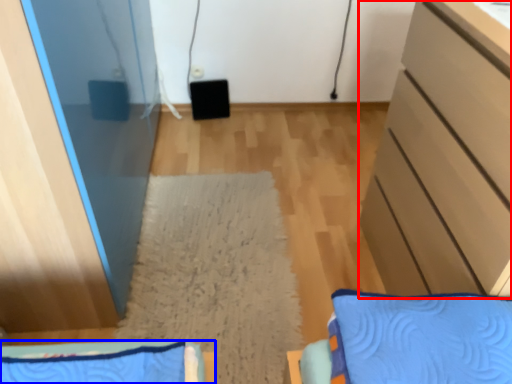
Question: Which object is closer to the camera taking this photo, cabinetry (highlighted by a red box) or furniture (highlighted by a blue box)?

Choices:
 (A) cabinetry
 (B) furniture

Answer: (B)